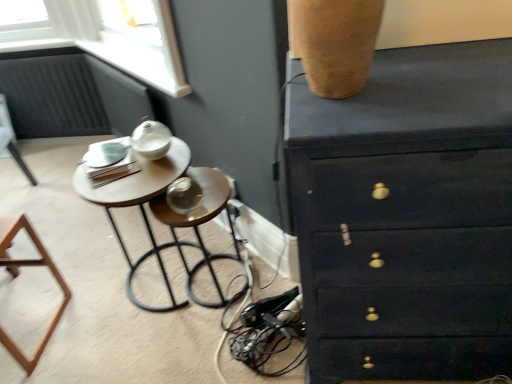
At what (x,y) coordinates should I click in order to perform the action: click on matte white lamp at upper left, positioned as the first furniture in top-to-bottom order. Please return your answer as a coordinate pair (x, y). This screenshot has height=384, width=512. Looking at the image, I should click on (11, 140).

What do you see at coordinates (199, 222) in the screenshot?
I see `wooden bar stool at center` at bounding box center [199, 222].

The width and height of the screenshot is (512, 384). In order to click on matte wood side table at left in this screenshot , I will do `click(139, 204)`.

In order to click on furniture in front of the matte wood side table at left in this screenshot , I will do `click(17, 276)`.

Considering the positions of point (11, 222) and point (159, 266), is point (11, 222) closer or farther from the camera than point (159, 266)?

Point (11, 222) is farther from the camera than point (159, 266).

Would you say brown wooden frame at lower left, which appears as the second furniture when viewed from the left, is outside matte wood side table at left?

Indeed, brown wooden frame at lower left, which appears as the second furniture when viewed from the left, is completely outside matte wood side table at left.

Between brown wooden frame at lower left, which ranks as the 2th furniture in back-to-front order, and matte wood side table at left, which one has smaller size?

With smaller size is brown wooden frame at lower left, which ranks as the 2th furniture in back-to-front order.

Considering the sizes of matte wood side table at left and dark wood chest of drawers at upper right in the image, is matte wood side table at left taller or shorter than dark wood chest of drawers at upper right?

Clearly, matte wood side table at left is shorter compared to dark wood chest of drawers at upper right.

Identify the location of table that appears behind the dark wood chest of drawers at upper right. The height and width of the screenshot is (384, 512). (139, 204).

Is matte wood side table at left beside dark wood chest of drawers at upper right?

There is a gap between matte wood side table at left and dark wood chest of drawers at upper right.

From the image's perspective, is matte wood side table at left above dark wood chest of drawers at upper right?

Actually, matte wood side table at left appears below dark wood chest of drawers at upper right in the image.

Image resolution: width=512 pixels, height=384 pixels. Find the location of `table behind the dark wood chest of drawers at upper right`. table behind the dark wood chest of drawers at upper right is located at coordinates (139, 204).

Does dark wood chest of drawers at upper right have a larger size compared to matte wood side table at left?

Indeed, dark wood chest of drawers at upper right has a larger size compared to matte wood side table at left.

Considering the relative sizes of dark wood chest of drawers at upper right and matte wood side table at left in the image provided, is dark wood chest of drawers at upper right shorter than matte wood side table at left?

No.

Looking at this image, is dark wood chest of drawers at upper right far away from matte wood side table at left?

Actually, dark wood chest of drawers at upper right and matte wood side table at left are a little close together.

Is brown wooden frame at lower left, the 1th furniture when ordered from front to back, aimed at dark wood chest of drawers at upper right?

No.

Measure the distance between brown wooden frame at lower left, the 1th furniture when ordered from front to back, and dark wood chest of drawers at upper right.

brown wooden frame at lower left, the 1th furniture when ordered from front to back, and dark wood chest of drawers at upper right are 1.35 meters apart.

Which point is more forward, (14, 273) or (500, 76)?

Point (500, 76)

Image resolution: width=512 pixels, height=384 pixels. Find the location of `furniture that is the 1st one below the dark wood chest of drawers at upper right (from a real-world perspective)`. furniture that is the 1st one below the dark wood chest of drawers at upper right (from a real-world perspective) is located at coordinates (17, 276).

Is dark wood chest of drawers at upper right oriented away from matte white lamp at upper left, arranged as the first furniture when viewed from the back?

dark wood chest of drawers at upper right is not turned away from matte white lamp at upper left, arranged as the first furniture when viewed from the back.

Does dark wood chest of drawers at upper right have a greater height compared to matte white lamp at upper left, positioned as the first furniture in top-to-bottom order?

Yes, dark wood chest of drawers at upper right is taller than matte white lamp at upper left, positioned as the first furniture in top-to-bottom order.

Considering the relative positions of dark wood chest of drawers at upper right and matte white lamp at upper left, positioned as the second furniture in right-to-left order, in the image provided, is dark wood chest of drawers at upper right in front of matte white lamp at upper left, positioned as the second furniture in right-to-left order,?

That is True.

Does dark wood chest of drawers at upper right have a larger size compared to matte white lamp at upper left, acting as the 2th furniture starting from the front?

Yes, dark wood chest of drawers at upper right is bigger than matte white lamp at upper left, acting as the 2th furniture starting from the front.

Is the surface of matte wood side table at left in direct contact with matte white lamp at upper left, positioned as the first furniture in top-to-bottom order?

matte wood side table at left is not next to matte white lamp at upper left, positioned as the first furniture in top-to-bottom order, and they're not touching.

From a real-world perspective, which is physically below, matte wood side table at left or matte white lamp at upper left, arranged as the first furniture when viewed from the back?

matte white lamp at upper left, arranged as the first furniture when viewed from the back, is physically lower.

Can you confirm if matte wood side table at left is shorter than matte white lamp at upper left, arranged as the first furniture when viewed from the back?

Incorrect, the height of matte wood side table at left does not fall short of that of matte white lamp at upper left, arranged as the first furniture when viewed from the back.

Locate an element on the screen. furniture that is the 2nd one when counting leftward from the matte wood side table at left is located at coordinates (11, 140).

Is matte wood side table at left positioned far away from brown wooden frame at lower left, the 1th furniture when ordered from front to back?

matte wood side table at left is actually quite close to brown wooden frame at lower left, the 1th furniture when ordered from front to back.

Could you tell me if matte wood side table at left is turned towards brown wooden frame at lower left, the 1th furniture when ordered from front to back?

No, matte wood side table at left is not aimed at brown wooden frame at lower left, the 1th furniture when ordered from front to back.

Considering the sizes of matte wood side table at left and brown wooden frame at lower left, which appears as the second furniture when viewed from the left, in the image, is matte wood side table at left wider or thinner than brown wooden frame at lower left, which appears as the second furniture when viewed from the left,?

matte wood side table at left is wider than brown wooden frame at lower left, which appears as the second furniture when viewed from the left.

The image size is (512, 384). Find the location of `table behind the brown wooden frame at lower left, the second furniture from the top`. table behind the brown wooden frame at lower left, the second furniture from the top is located at coordinates (139, 204).

At what (x,y) coordinates should I click in order to perform the action: click on chest of drawers above the matte wood side table at left (from the image's perspective). Please return your answer as a coordinate pair (x, y). The width and height of the screenshot is (512, 384). Looking at the image, I should click on 407,216.

Which object lies nearer to the anchor point brown wooden frame at lower left, the 1th furniture when ordered from front to back, matte white lamp at upper left, positioned as the first furniture in top-to-bottom order, or wooden bar stool at center?

wooden bar stool at center.

Looking at the image, which one is located closer to brown wooden frame at lower left, which ranks as the 2th furniture in back-to-front order, matte wood side table at left or dark wood chest of drawers at upper right?

matte wood side table at left is positioned closer to the anchor brown wooden frame at lower left, which ranks as the 2th furniture in back-to-front order.

When comparing their distances from matte wood side table at left, does dark wood chest of drawers at upper right or brown wooden frame at lower left, which ranks as the 2th furniture in back-to-front order, seem further?

Among the two, dark wood chest of drawers at upper right is located further to matte wood side table at left.

Considering their positions, is matte wood side table at left positioned further to wooden bar stool at center than matte white lamp at upper left, arranged as the first furniture when viewed from the back?

matte white lamp at upper left, arranged as the first furniture when viewed from the back.

Looking at this image, which object lies further to the anchor point dark wood chest of drawers at upper right, matte wood side table at left or matte white lamp at upper left, positioned as the second furniture in right-to-left order?

matte white lamp at upper left, positioned as the second furniture in right-to-left order, lies further to dark wood chest of drawers at upper right than the other object.

Looking at the image, which one is located further to matte wood side table at left, brown wooden frame at lower left, the 1th furniture when ordered from front to back, or dark wood chest of drawers at upper right?

The object further to matte wood side table at left is dark wood chest of drawers at upper right.

Which object lies nearer to the anchor point matte white lamp at upper left, arranged as the first furniture when viewed from the back, brown wooden frame at lower left, the second furniture from the top, or matte wood side table at left?

brown wooden frame at lower left, the second furniture from the top, lies closer to matte white lamp at upper left, arranged as the first furniture when viewed from the back, than the other object.

From the image, which object appears to be farther from matte white lamp at upper left, the 2th furniture from the bottom, wooden bar stool at center or brown wooden frame at lower left, the second furniture from the top?

wooden bar stool at center lies further to matte white lamp at upper left, the 2th furniture from the bottom, than the other object.

Image resolution: width=512 pixels, height=384 pixels. I want to click on table between brown wooden frame at lower left, which ranks as the 1th furniture in bottom-to-top order, and matte white lamp at upper left, positioned as the second furniture in right-to-left order, from front to back, so click(x=139, y=204).

At what (x,y) coordinates should I click in order to perform the action: click on furniture between matte white lamp at upper left, arranged as the first furniture when viewed from the back, and dark wood chest of drawers at upper right. Please return your answer as a coordinate pair (x, y). This screenshot has width=512, height=384. Looking at the image, I should click on (17, 276).

Find the location of a particular element. The image size is (512, 384). table between matte white lamp at upper left, positioned as the second furniture in right-to-left order, and wooden bar stool at center is located at coordinates (139, 204).

I want to click on table between brown wooden frame at lower left, placed as the 1th furniture when sorted from right to left, and wooden bar stool at center, so click(x=139, y=204).